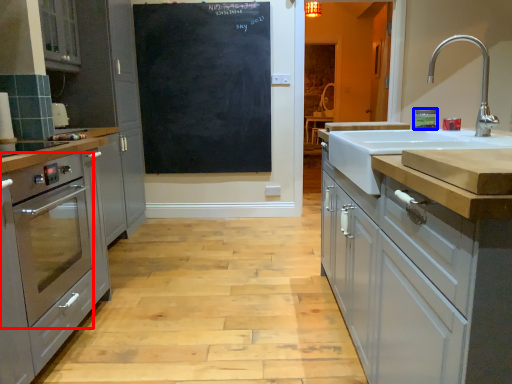
Question: Which object is further to the camera taking this photo, home appliance (highlighted by a red box) or appliance (highlighted by a blue box)?

Choices:
 (A) home appliance
 (B) appliance

Answer: (B)